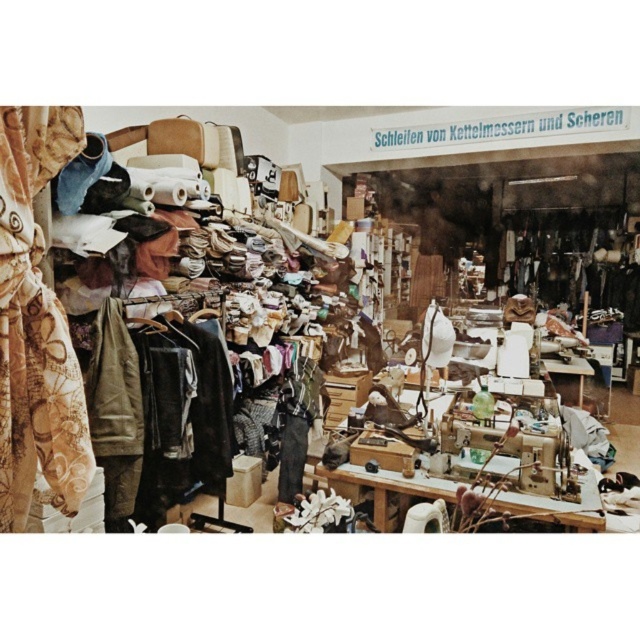
Can you confirm if textured fabric jackets at left is bigger than beige floral fabric at left?

Indeed, textured fabric jackets at left has a larger size compared to beige floral fabric at left.

Between textured fabric jackets at left and beige floral fabric at left, which one appears on the right side from the viewer's perspective?

Positioned to the right is textured fabric jackets at left.

Where is `textured fabric jackets at left`? The height and width of the screenshot is (640, 640). textured fabric jackets at left is located at coordinates (544, 483).

From the picture: Which is more to the left, textured fabric jackets at left or leather jacket at center?

From the viewer's perspective, textured fabric jackets at left appears more on the left side.

This screenshot has width=640, height=640. Describe the element at coordinates (544, 483) in the screenshot. I see `textured fabric jackets at left` at that location.

Does point (384, 515) lie in front of point (579, 225)?

Yes, it is.

Where is `textured fabric jackets at left`? The image size is (640, 640). textured fabric jackets at left is located at coordinates (544, 483).

Is beige floral fabric at left below leather jacket at center?

Yes.

Which of these two, beige floral fabric at left or leather jacket at center, stands shorter?

beige floral fabric at left is shorter.

Image resolution: width=640 pixels, height=640 pixels. Describe the element at coordinates (36, 324) in the screenshot. I see `beige floral fabric at left` at that location.

Identify the location of beige floral fabric at left. The image size is (640, 640). (36, 324).